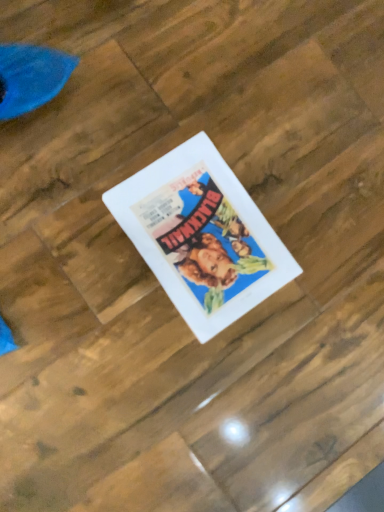
Locate an element on the screen. The image size is (384, 512). vacant area located to the right-hand side of white paper at center is located at coordinates (305, 324).